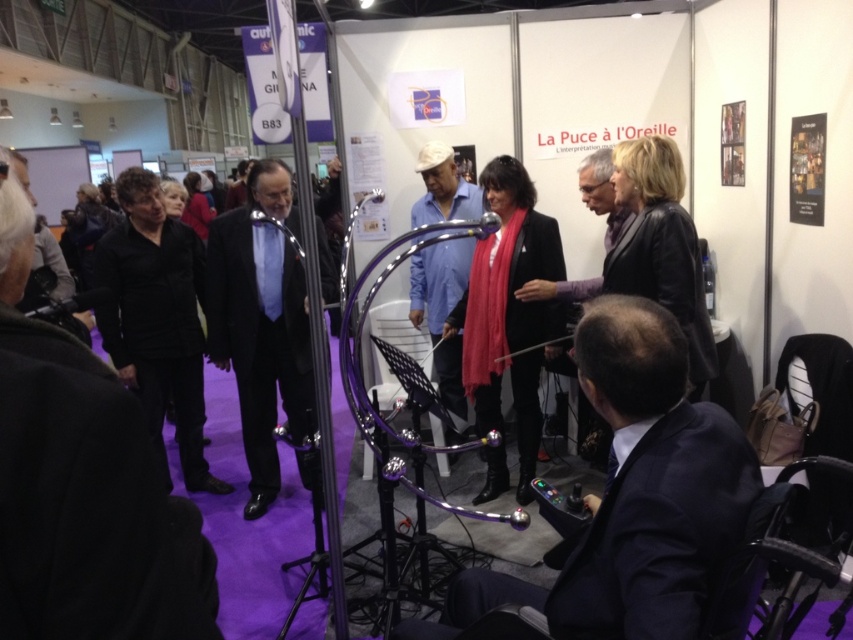
You are organizing a photo shoot and need to place the black leather jacket at upper left and the blue matte shirt at center in a way that maintains their size relationship. Which item should be placed closer to the camera to ensure the size difference is preserved?

The black leather jacket at upper left should be placed closer to the camera because it has a smaller size compared to the blue matte shirt at center, so positioning it nearer will maintain the size difference.

You are a photographer at the event and want to capture the black satin suit at center in your photo. The camera you are using has a 100mm lens with a field of view that can capture objects within a 60 degree angle. Given that the point at coordinates (260, 323) is where the black satin suit at center is located, can you determine if the black satin suit at center will be within the camera lens field of view?

The point at coordinates (260, 323) corresponds to the black satin suit at center, so yes, it will be within the camera lens field of view since the coordinates are within the 60 degree angle captured by the 100mm lens.

You are a photographer at the event and want to take a photo that includes both the dark blue suit at lower right and the black satin suit at center. Based on their positions, which one should you ensure is placed lower in the frame to include both?

The dark blue suit at lower right is located below the black satin suit at center, so to include both in the photo, you should ensure the black satin suit at center is placed higher in the frame while keeping the dark blue suit at lower right at the bottom.